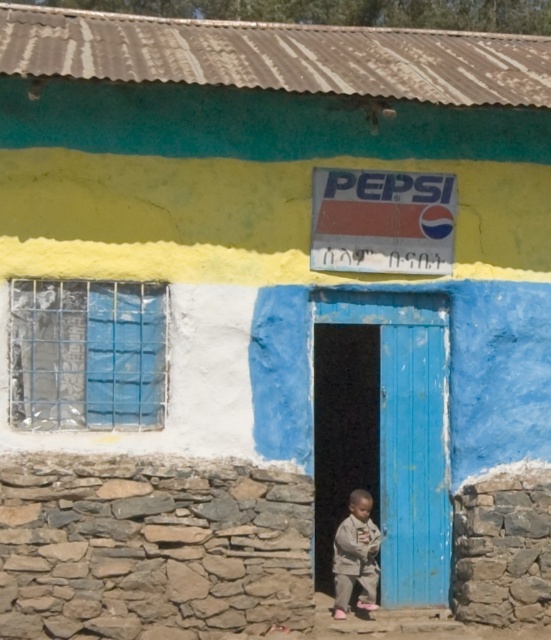
Who is positioned more to the left, blue wooden door at center or light brown fabric pants at lower center?

From the viewer's perspective, light brown fabric pants at lower center appears more on the left side.

Does blue wooden door at center appear on the left side of light brown fabric pants at lower center?

In fact, blue wooden door at center is to the right of light brown fabric pants at lower center.

Who is more distant from viewer, (x=387, y=586) or (x=364, y=577)?

The point (x=387, y=586) is behind.

At what (x,y) coordinates should I click in order to perform the action: click on blue wooden door at center. Please return your answer as a coordinate pair (x, y). The image size is (551, 640). Looking at the image, I should click on (407, 436).